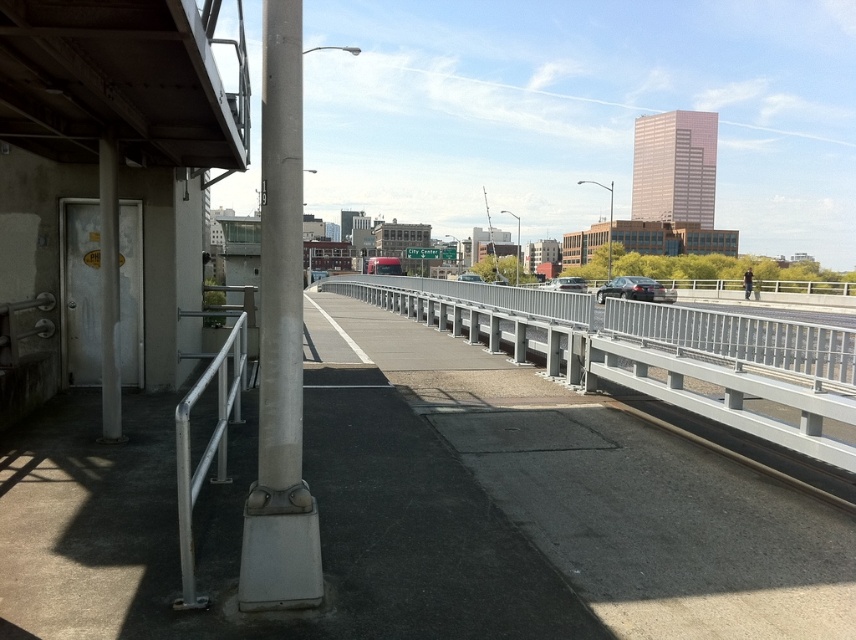
You are a delivery person needing to load a package onto a truck. The truck requires a clearance of 2 meters. Given the satin silver pole at left and the satin silver sedan at center, which object is more likely to block the truck from passing under the walkway?

The satin silver sedan at center is taller than the satin silver pole at left. Since the truck requires a clearance of 2 meters, the satin silver sedan at center is more likely to block the truck from passing under the walkway if its height exceeds the clearance requirement.

You are standing on the pedestrian walkway and want to take a photo of both the point at coordinates (282, 348) and the point at coordinates (569, 284). Since you want both points in focus, which point should you focus on to ensure the other is also in focus?

You should focus on the point at coordinates (569, 284) because it is farther away from the camera than the point at coordinates (282, 348). By focusing on the farther point, the closer point will also be within the depth of field, ensuring both are in focus.